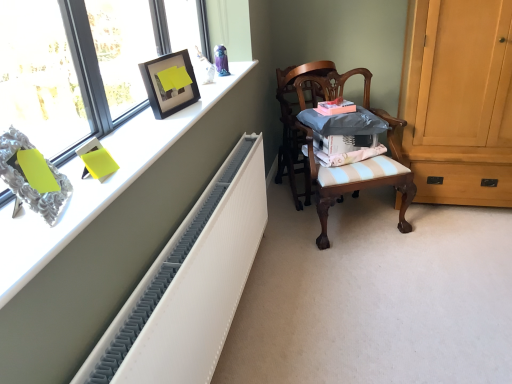
Where is `free space above white textured radiator at upper left (from a real-world perspective)`? This screenshot has width=512, height=384. free space above white textured radiator at upper left (from a real-world perspective) is located at coordinates (143, 135).